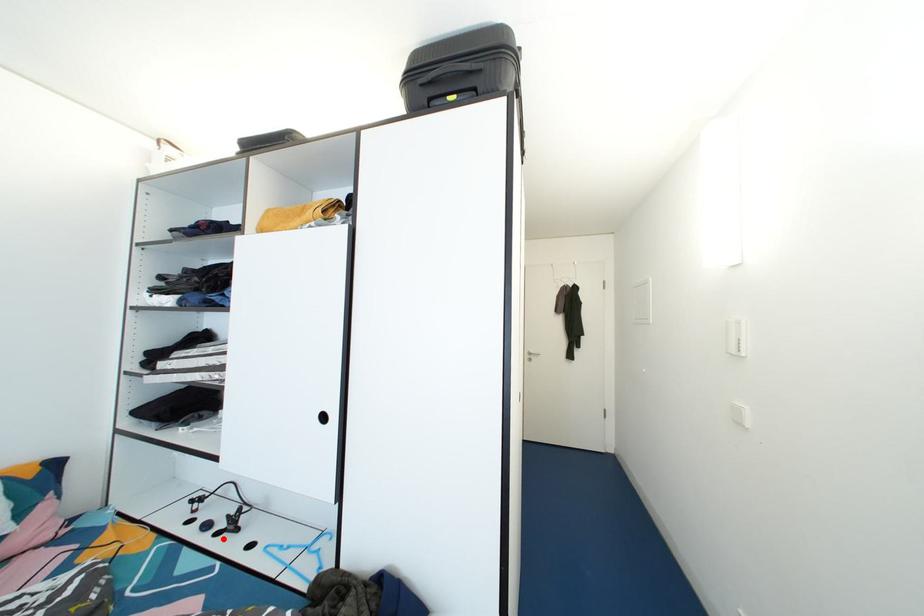
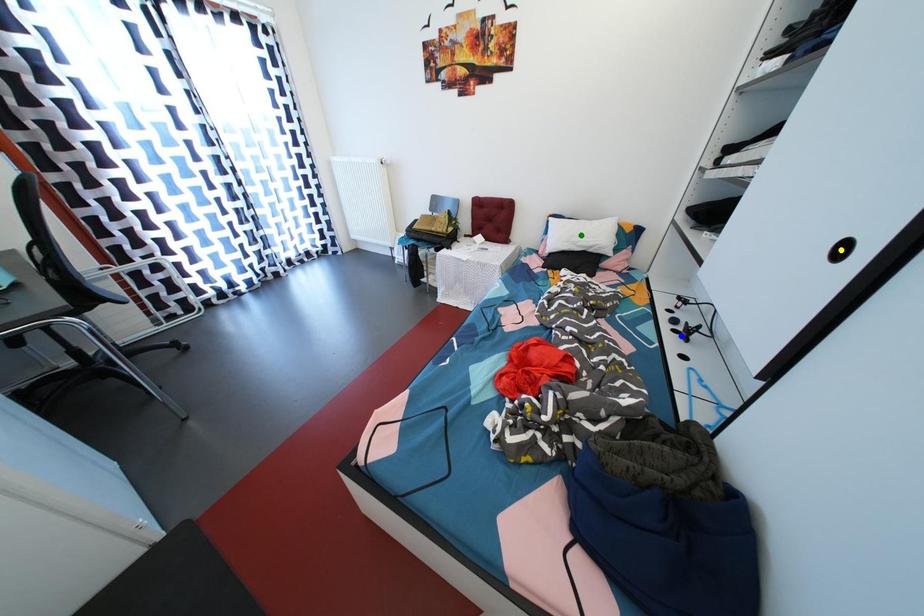
Question: I am providing you with two images of the same scene from different viewpoints. A red point is marked on the first image. You are given multiple points on the second image. Can you choose the point in image 2 that corresponds to the point in image 1?

Choices:
 (A) blue point
 (B) yellow point
 (C) green point

Answer: (A)